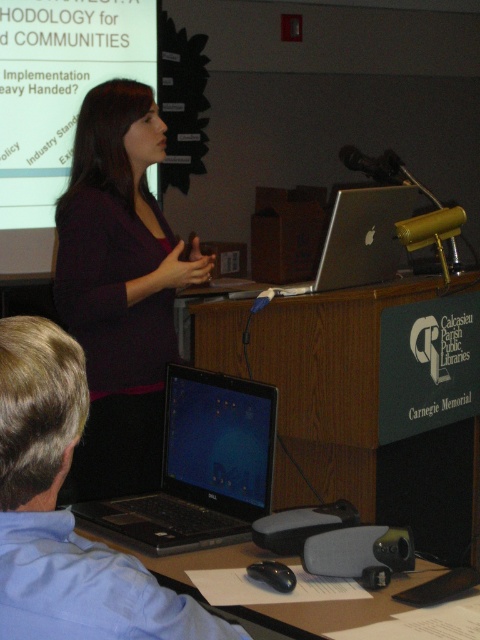
You are sitting in the audience at a library presentation. You see a white matte projection screen at upper left and a silver metallic laptop at center. Which object is closer to you?

The white matte projection screen at upper left is closer to you because it is further to the viewer than the silver metallic laptop at center.

You are a photographer positioned at the back of the room. You need to capture a clear photo of the matte purple shirt at center and the white matte projection screen at upper left. Considering their distance, will both subjects be in focus if your camera has a depth of field that can cover 4 feet?

The matte purple shirt at center is 3.78 feet away from the white matte projection screen at upper left. Since the depth of field can cover 4 feet, both subjects will be in focus as the distance between them is within the camera setting.

Looking at this image, you are a presenter who needs to walk from the silver metallic laptop at center to the white matte projection screen at upper left to adjust the presentation. Given that you have a 1.2 meter long projector remote in your hand, can you safely reach the screen without needing to move closer?

The distance between the white matte projection screen at upper left and the silver metallic laptop at center is 1.41 meters. Since the projector remote is only 1.2 meters long, you cannot safely reach the screen from the laptop without moving closer.